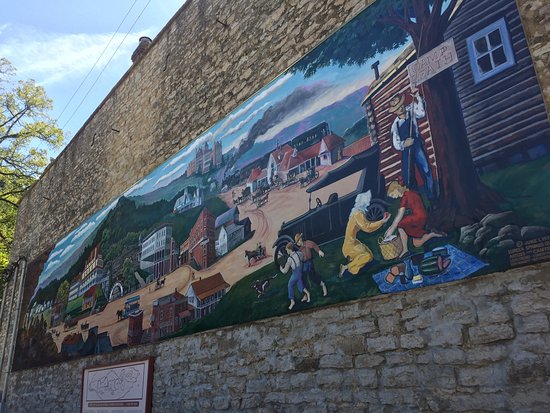
Locate an element on the screen. This screenshot has height=413, width=550. paint is located at coordinates coord(329,87).